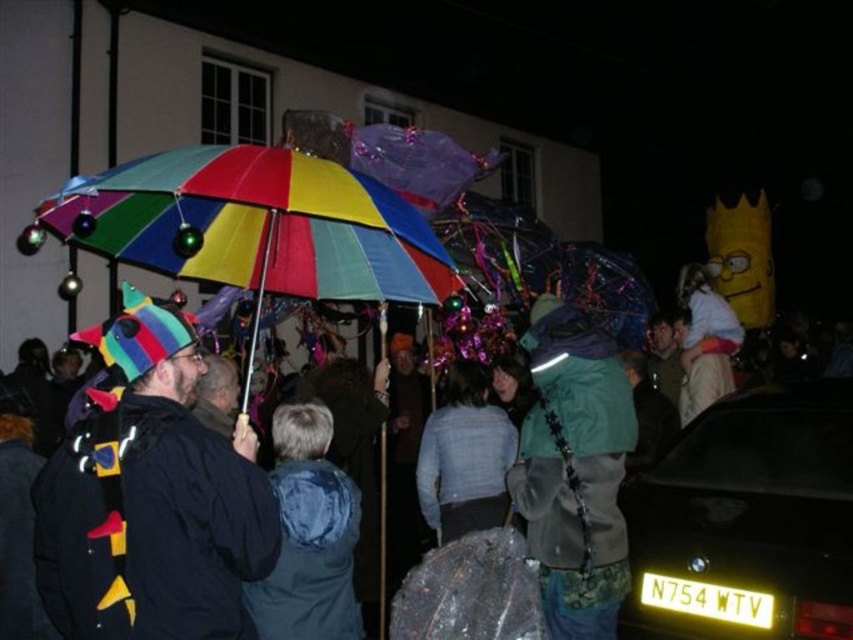
In the scene shown: You are a photographer trying to capture a group photo of the light blue fabric jacket at center and the white fluffy costume at upper right. Since you want both subjects to appear equally prominent in the photo, which subject should you move closer to the camera?

The light blue fabric jacket at center has a smaller size compared to white fluffy costume at upper right, so you should move closer to the light blue fabric jacket at center to make it appear larger in the photo and balance its prominence with the white fluffy costume at upper right.

Consider the image. You are a photographer trying to capture a photo of the light blue fabric jacket at center and the white fluffy costume at upper right. Since you want both subjects to be in focus, which one should you focus on first to ensure both are sharp?

You should focus on the white fluffy costume at upper right first because it is farther away than the light blue fabric jacket at center, so focusing on the farther subject will help both be in focus.